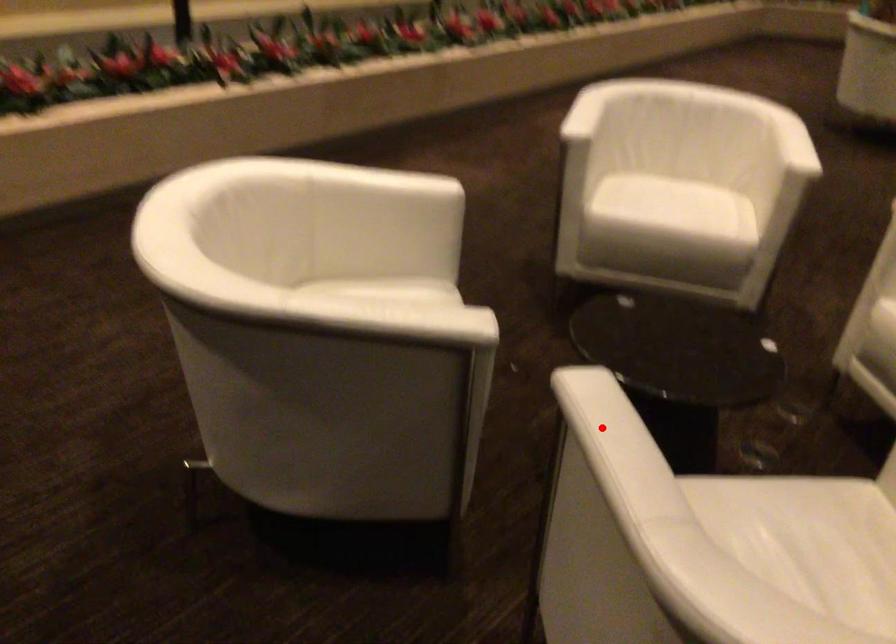
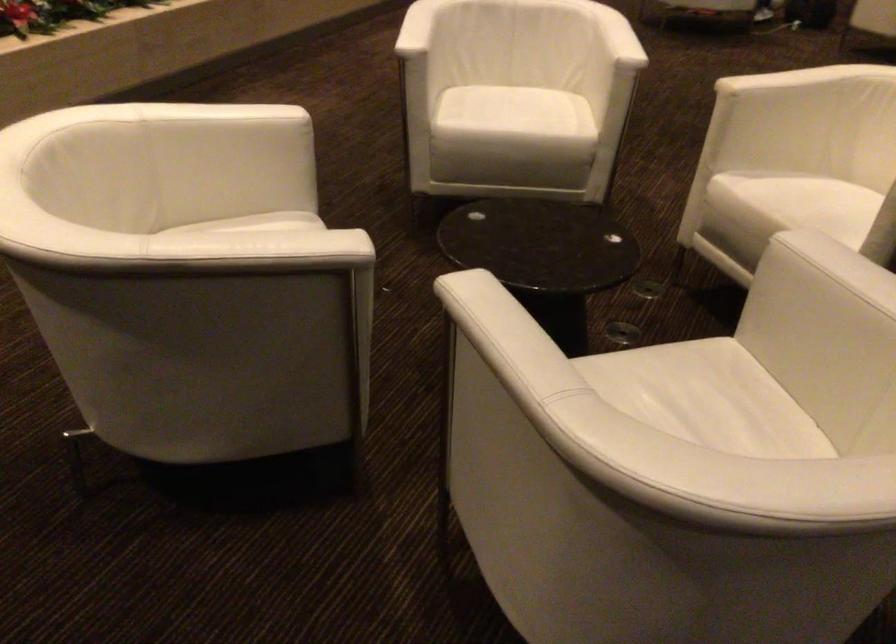
In the second image, find the point that corresponds to the highlighted location in the first image.

(494, 322)